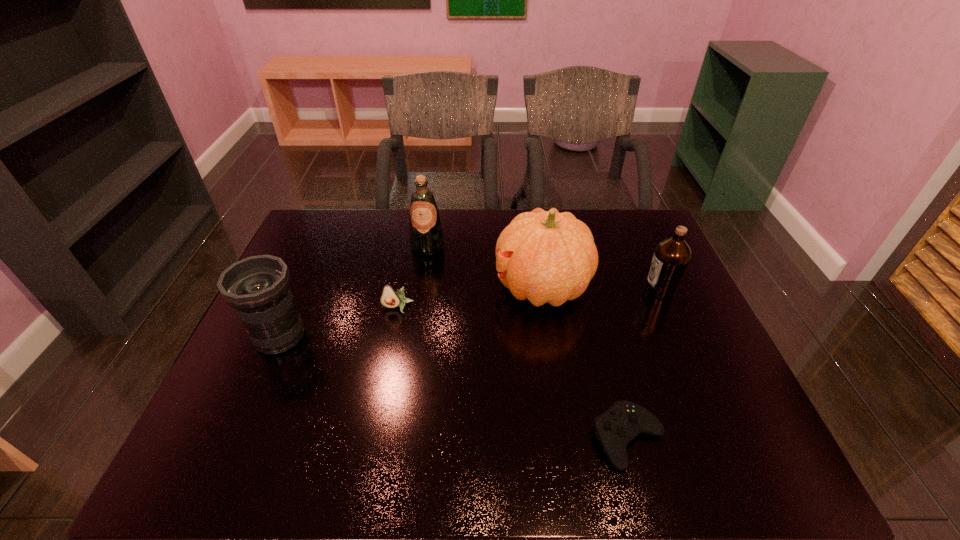
Locate an element on the screen. The image size is (960, 540). vacant space that satisfies the following two spatial constraints: 1. on the front-facing side of the left olive oil; 2. on the right side of the shortest object is located at coordinates (400, 438).

You are a GUI agent. You are given a task and a screenshot of the screen. Output one action in this format:
    pyautogui.click(x=<x>, y=<y>)
    Task: Click on the free point that satisfies the following two spatial constraints: 1. on the label of the shorter olive oil; 2. on the seed side of the avocado
    
    Given the screenshot: What is the action you would take?
    pyautogui.click(x=667, y=307)

Locate an element on the screen. Image resolution: width=960 pixels, height=540 pixels. vacant space that satisfies the following two spatial constraints: 1. on the front-facing side of the farther olive oil; 2. on the right side of the shortest object is located at coordinates (400, 438).

This screenshot has height=540, width=960. What are the coordinates of `vacant space that satisfies the following two spatial constraints: 1. on the seed side of the nearest object; 2. on the left side of the second shortest object` in the screenshot? It's located at (372, 438).

The height and width of the screenshot is (540, 960). In order to click on blank area in the image that satisfies the following two spatial constraints: 1. on the carved face of the pumpkin; 2. on the left side of the control in this screenshot , I will do `click(564, 438)`.

Where is `free location that satisfies the following two spatial constraints: 1. on the label of the right olive oil; 2. on the front side of the control`? This screenshot has width=960, height=540. free location that satisfies the following two spatial constraints: 1. on the label of the right olive oil; 2. on the front side of the control is located at coordinates (724, 438).

I want to click on vacant space that satisfies the following two spatial constraints: 1. on the carved face of the pumpkin; 2. on the seed side of the avocado, so click(x=545, y=307).

Identify the location of free space that satisfies the following two spatial constraints: 1. on the carved face of the pumpkin; 2. on the back side of the nearest object. (564, 438).

At what (x,y) coordinates should I click in order to perform the action: click on free space that satisfies the following two spatial constraints: 1. on the label of the right olive oil; 2. on the seed side of the avocado. Please return your answer as a coordinate pair (x, y). The width and height of the screenshot is (960, 540). Looking at the image, I should click on click(x=667, y=307).

In order to click on free space that satisfies the following two spatial constraints: 1. on the label of the nearer olive oil; 2. on the front side of the telephoto lens in this screenshot , I will do `click(680, 336)`.